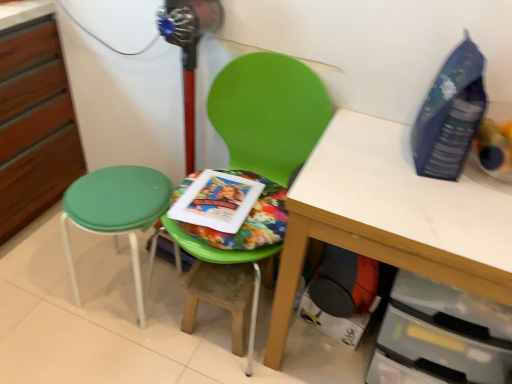
The width and height of the screenshot is (512, 384). Identify the location of free space to the left of blue plastic bottle at upper right. (372, 152).